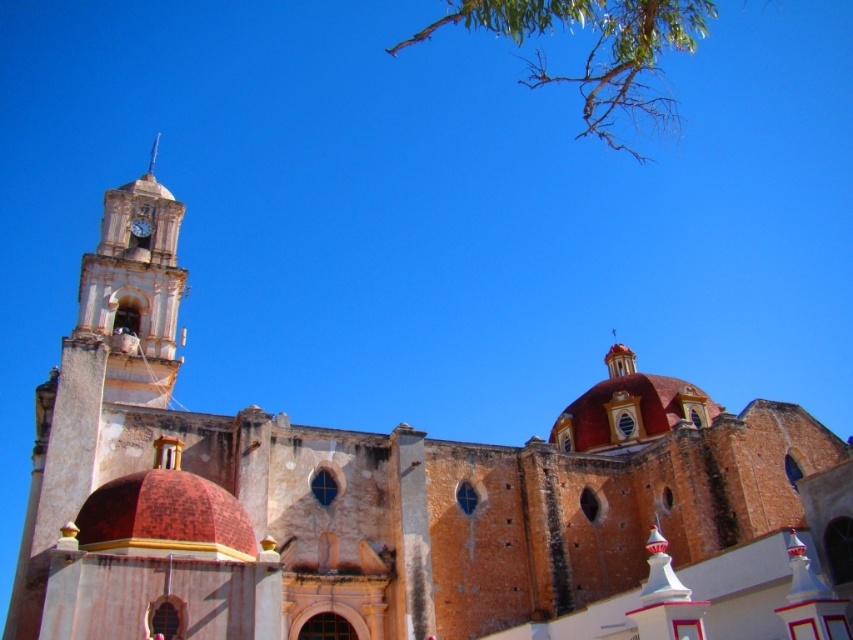
Is white stone clock tower at upper left smaller than metallic gold clock at upper left?

Actually, white stone clock tower at upper left might be larger than metallic gold clock at upper left.

This screenshot has height=640, width=853. I want to click on white stone clock tower at upper left, so click(x=135, y=291).

Between green leafy branches at upper center and metallic gold clock at upper left, which one is positioned higher?

green leafy branches at upper center is higher up.

Does green leafy branches at upper center appear under metallic gold clock at upper left?

No.

Locate an element on the screen. Image resolution: width=853 pixels, height=640 pixels. green leafy branches at upper center is located at coordinates (593, 49).

The height and width of the screenshot is (640, 853). Find the location of `green leafy branches at upper center`. green leafy branches at upper center is located at coordinates (593, 49).

Between white stone clock tower at upper left and green leafy branches at upper center, which one is positioned higher?

green leafy branches at upper center is above.

Image resolution: width=853 pixels, height=640 pixels. Describe the element at coordinates (135, 291) in the screenshot. I see `white stone clock tower at upper left` at that location.

What do you see at coordinates (135, 291) in the screenshot? Image resolution: width=853 pixels, height=640 pixels. I see `white stone clock tower at upper left` at bounding box center [135, 291].

Where is `white stone clock tower at upper left`? This screenshot has height=640, width=853. white stone clock tower at upper left is located at coordinates (135, 291).